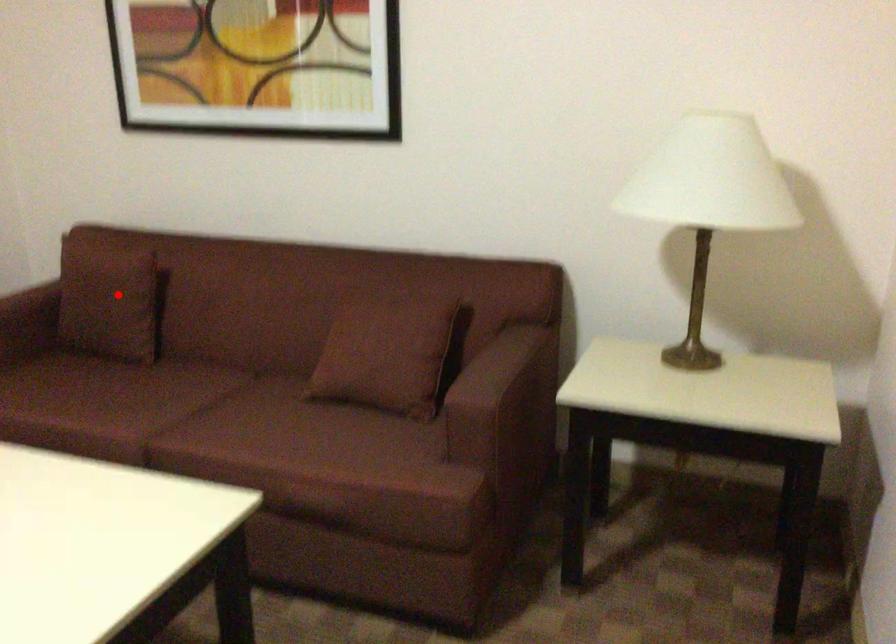
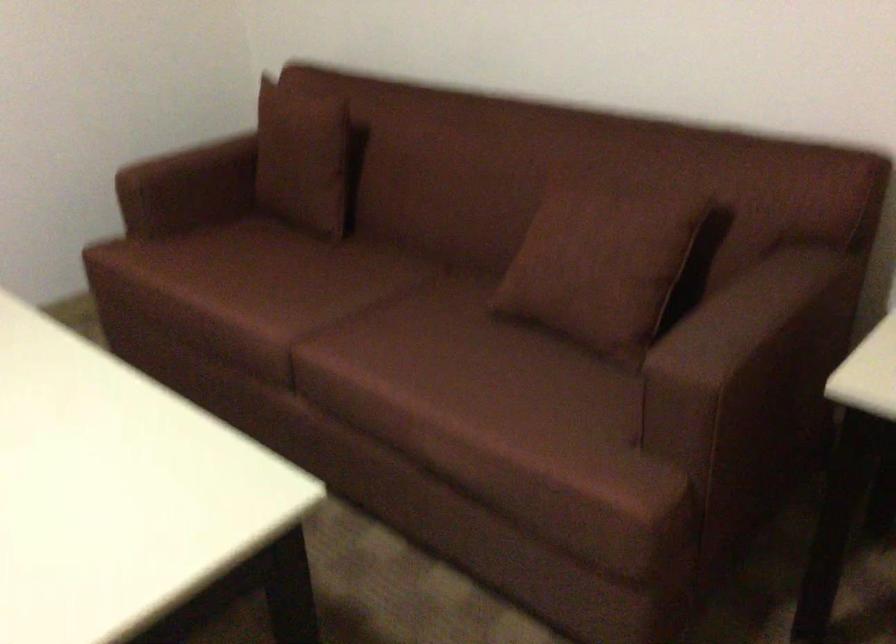
In the second image, find the point that corresponds to the highlighted location in the first image.

(306, 158)